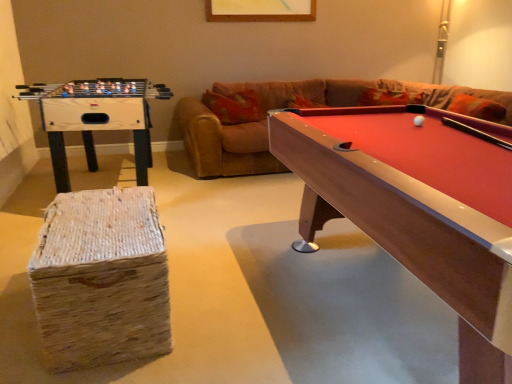
Question: Is wooden foosball table at left shorter than rubberized wood billiard table at right?

Choices:
 (A) yes
 (B) no

Answer: (B)

Question: Is wooden foosball table at left looking in the opposite direction of rubberized wood billiard table at right?

Choices:
 (A) no
 (B) yes

Answer: (A)

Question: Is wooden foosball table at left not within rubberized wood billiard table at right?

Choices:
 (A) yes
 (B) no

Answer: (A)

Question: Considering the relative positions of wooden foosball table at left and rubberized wood billiard table at right in the image provided, is wooden foosball table at left to the right of rubberized wood billiard table at right from the viewer's perspective?

Choices:
 (A) no
 (B) yes

Answer: (A)

Question: Does wooden foosball table at left have a smaller size compared to rubberized wood billiard table at right?

Choices:
 (A) no
 (B) yes

Answer: (B)

Question: Is wooden foosball table at left positioned far away from rubberized wood billiard table at right?

Choices:
 (A) yes
 (B) no

Answer: (A)

Question: Does rubberized wood billiard table at right have a greater height compared to wooden foosball table at left?

Choices:
 (A) no
 (B) yes

Answer: (A)

Question: Could you tell me if rubberized wood billiard table at right is facing wooden foosball table at left?

Choices:
 (A) no
 (B) yes

Answer: (A)

Question: From the image's perspective, is rubberized wood billiard table at right over wooden foosball table at left?

Choices:
 (A) yes
 (B) no

Answer: (B)

Question: From a real-world perspective, is rubberized wood billiard table at right located beneath wooden foosball table at left?

Choices:
 (A) yes
 (B) no

Answer: (A)

Question: Is rubberized wood billiard table at right to the right of wooden foosball table at left from the viewer's perspective?

Choices:
 (A) no
 (B) yes

Answer: (B)

Question: Considering the relative sizes of rubberized wood billiard table at right and wooden foosball table at left in the image provided, is rubberized wood billiard table at right bigger than wooden foosball table at left?

Choices:
 (A) yes
 (B) no

Answer: (A)

Question: Does woven straw stool at lower left appear on the left side of wooden foosball table at left?

Choices:
 (A) yes
 (B) no

Answer: (B)